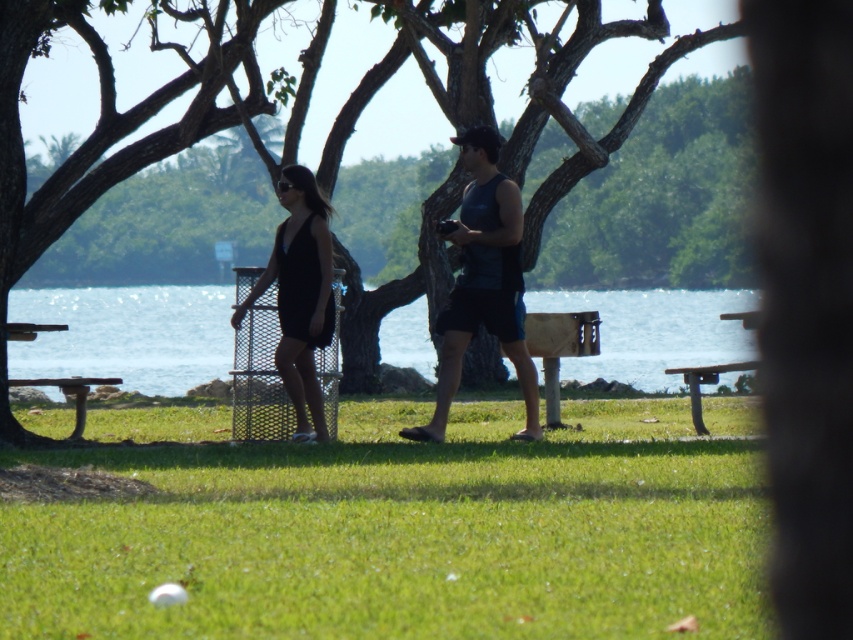
You are planning to set up a small tent for a picnic. You have two options for locations in the image. The first is near the clear blue water at center and the second is near the wooden picnic table at lower right. Which location offers more horizontal space for your tent?

The clear blue water at center offers more horizontal space for your tent because its width surpasses that of the wooden picnic table at lower right.

You are standing at the edge of the grassy area in the park scene and want to reach the clear blue water at center. Which direction should you walk to get there?

The clear blue water at center is located at point coordinates, so you should walk towards the center of the image to reach it.

You are planning to set up a picnic at the park. You see the black matte dress at center and the metallic silver picnic table at left. Which object should you place the food on?

The metallic silver picnic table at left is the appropriate surface for placing food, as the black matte dress at center is positioned over it and likely belongs to a person.